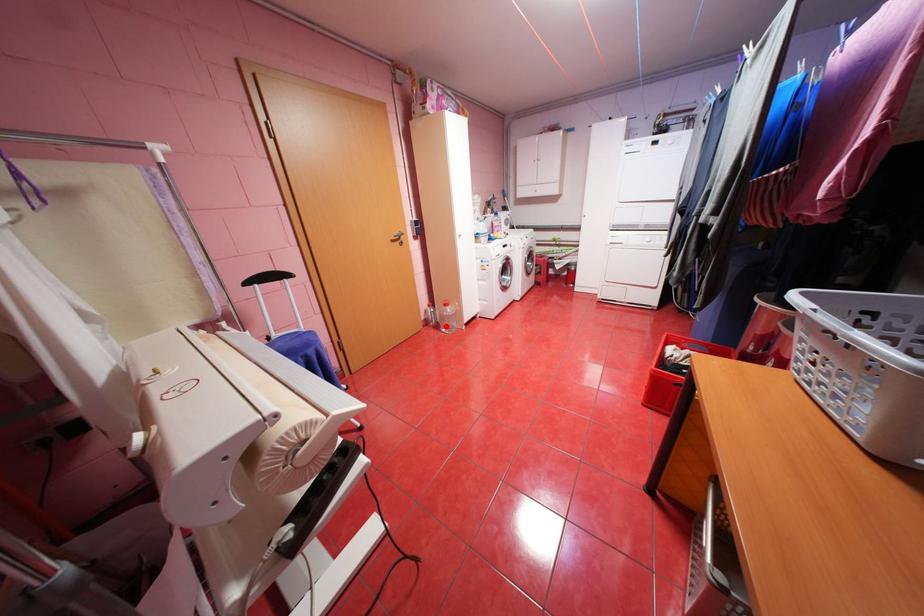
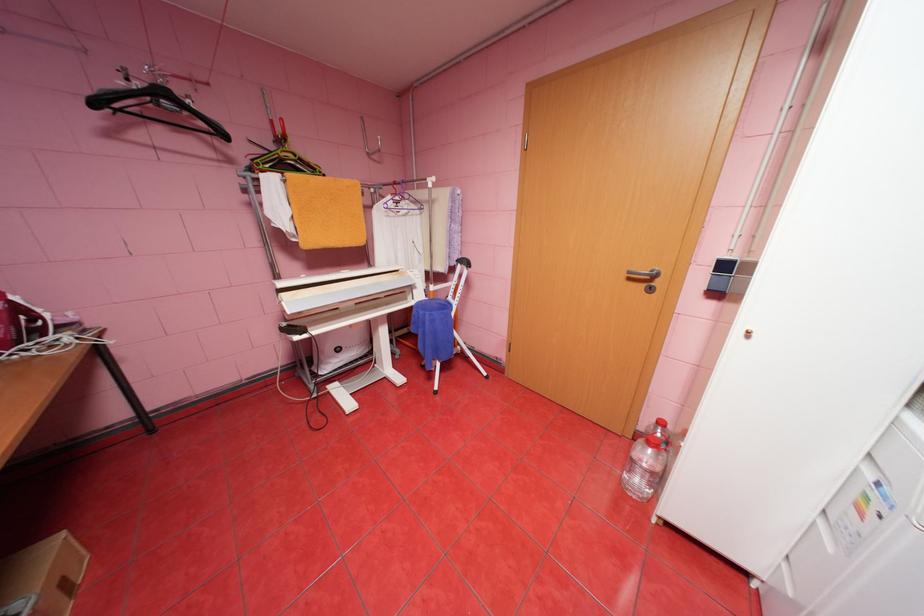
In the second image, find the point that corresponds to the highlighted location in the first image.

(645, 459)